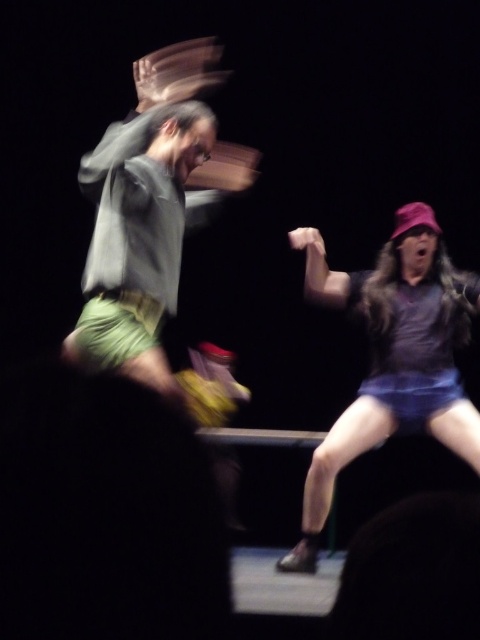
You are a photographer standing in front of the scene. You want to take a photo of the purple matte shirt at center and green cotton shorts at left. Which one should you focus on first if you want to capture them both in the frame?

You should focus on the purple matte shirt at center first because it is closer to the photographer than the green cotton shorts at left, which is further away.

Where is the green cotton shorts at left located in the image?

The green cotton shorts at left is located at point (149, 211) in the image.